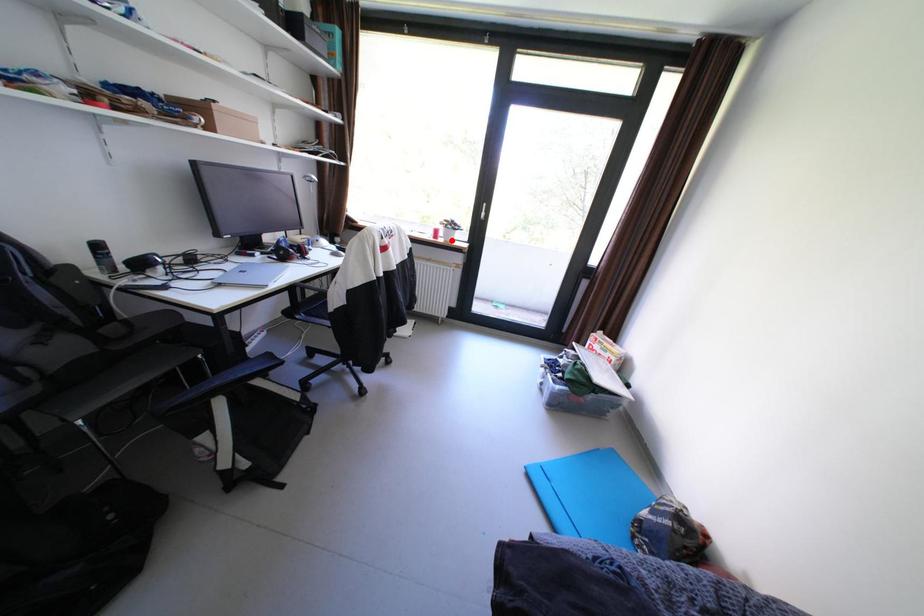
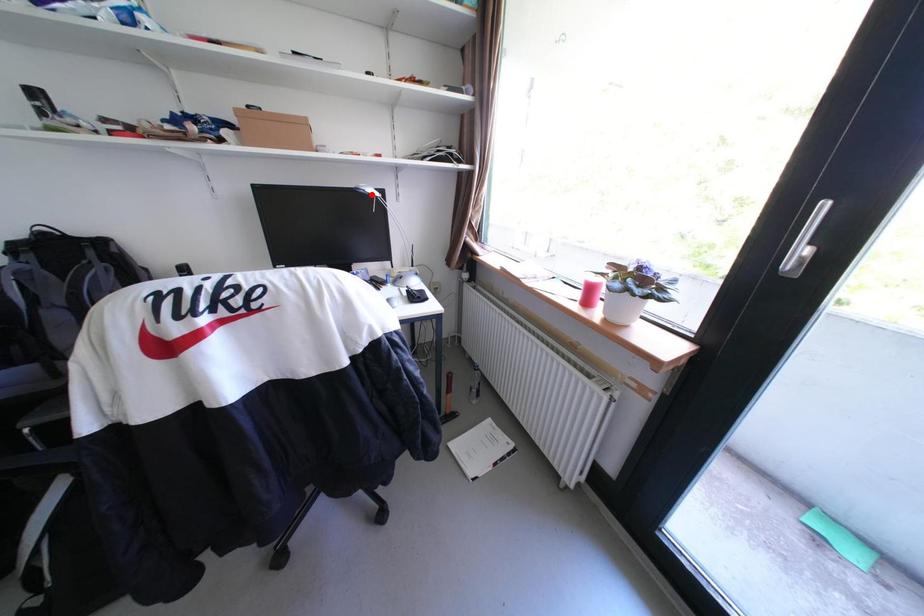
I am providing you with two images of the same scene from different viewpoints. A red point is marked on the first image and another point is marked on the second image. Do the highlighted points in image1 and image2 indicate the same real-world spot?

No